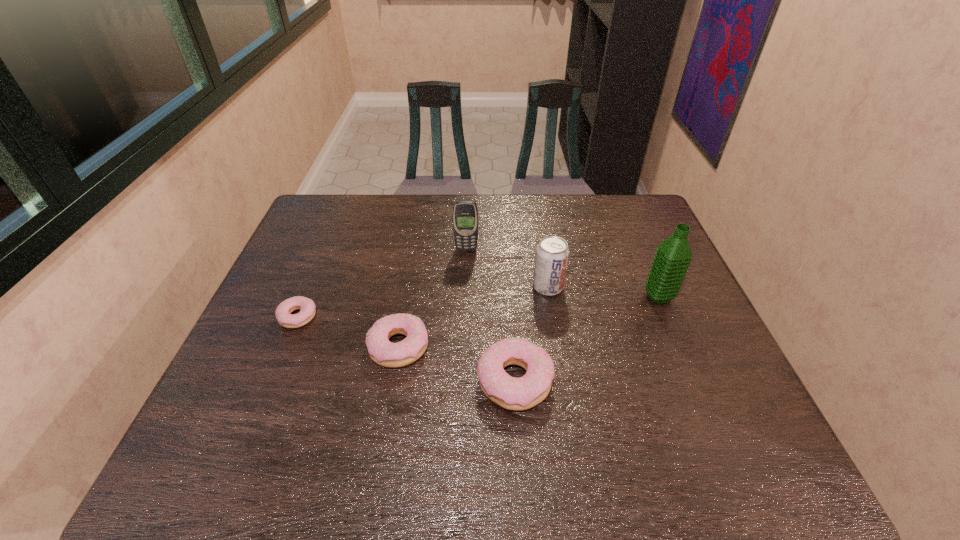
Please show where to add a doughnut on the right while keeping spacing even. Please provide its 2D coordinates. Your answer should be formatted as a tuple, i.e. [(x, y)], where the tuple contains the x and y coordinates of a point satisfying the conditions above.

[(649, 419)]